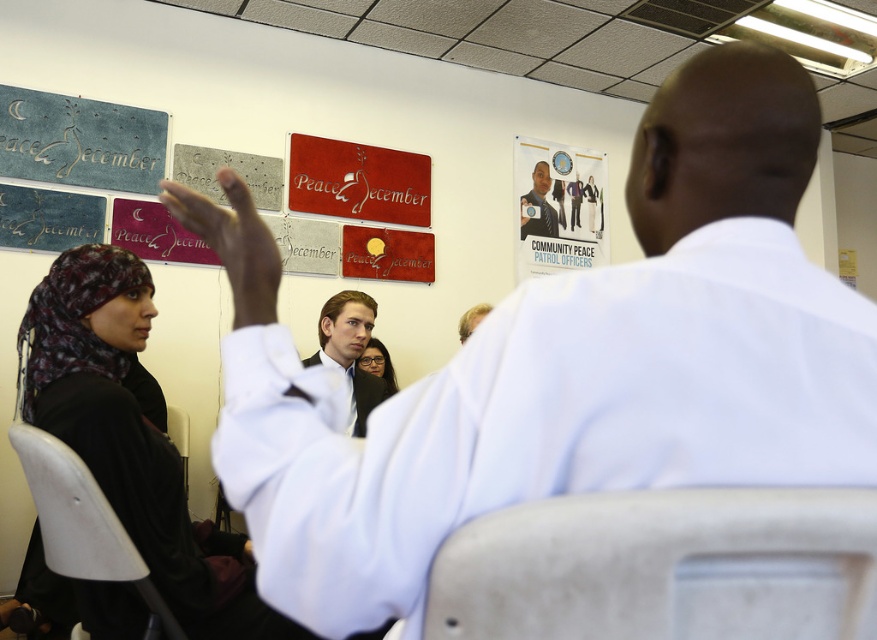
You are a photographer in the room and want to capture a clear photo of both the light brown shirt at center and the dark blue uniform at upper center. Can you adjust your position so that neither of them is blocking the other?

The light brown shirt at center is in front of dark blue uniform at upper center, so you cannot capture both clearly without moving either the light brown shirt at center or the dark blue uniform at upper center.